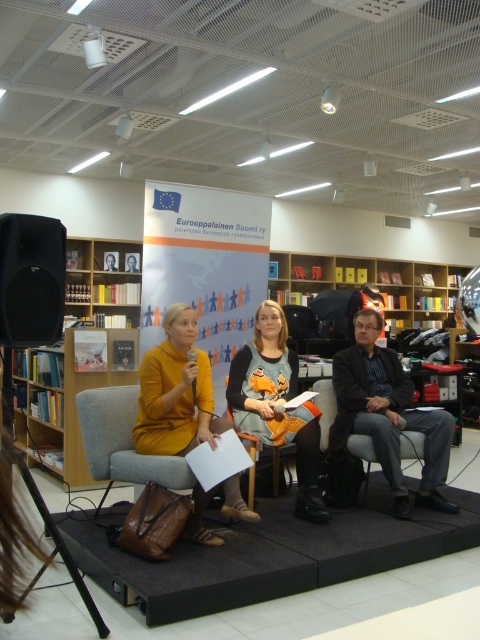
Question: Does mustard yellow fabric armchair at center have a greater width compared to orange fabric armchair at center?

Choices:
 (A) yes
 (B) no

Answer: (A)

Question: Does matte gray dress at center appear on the right side of orange fabric armchair at center?

Choices:
 (A) yes
 (B) no

Answer: (A)

Question: Does matte yellow sweater at center appear under mustard yellow fabric armchair at center?

Choices:
 (A) yes
 (B) no

Answer: (B)

Question: Which point is closer to the camera?

Choices:
 (A) (78, 304)
 (B) (44, 266)

Answer: (B)

Question: Which point is farther to the camera?

Choices:
 (A) click(x=312, y=522)
 (B) click(x=439, y=442)

Answer: (B)

Question: Which of the following is the farthest from the observer?

Choices:
 (A) (212, 419)
 (B) (312, 484)
 (C) (350, 451)

Answer: (C)